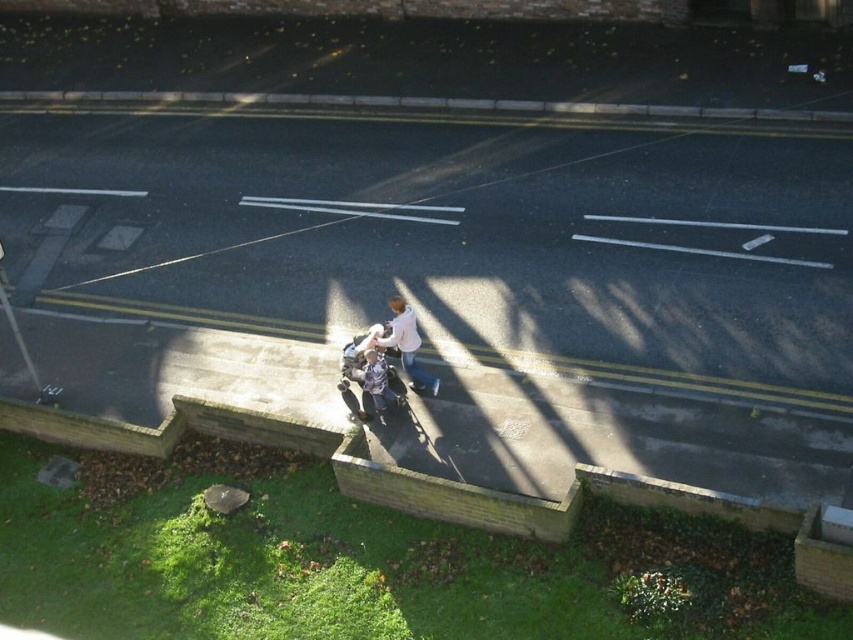
Is point (405, 349) positioned in front of point (381, 410)?

Yes.

The width and height of the screenshot is (853, 640). What do you see at coordinates (407, 346) in the screenshot?
I see `white matte shirt at center` at bounding box center [407, 346].

Who is more forward, (416, 371) or (379, 406)?

Positioned in front is point (379, 406).

Identify the location of white matte shirt at center. (407, 346).